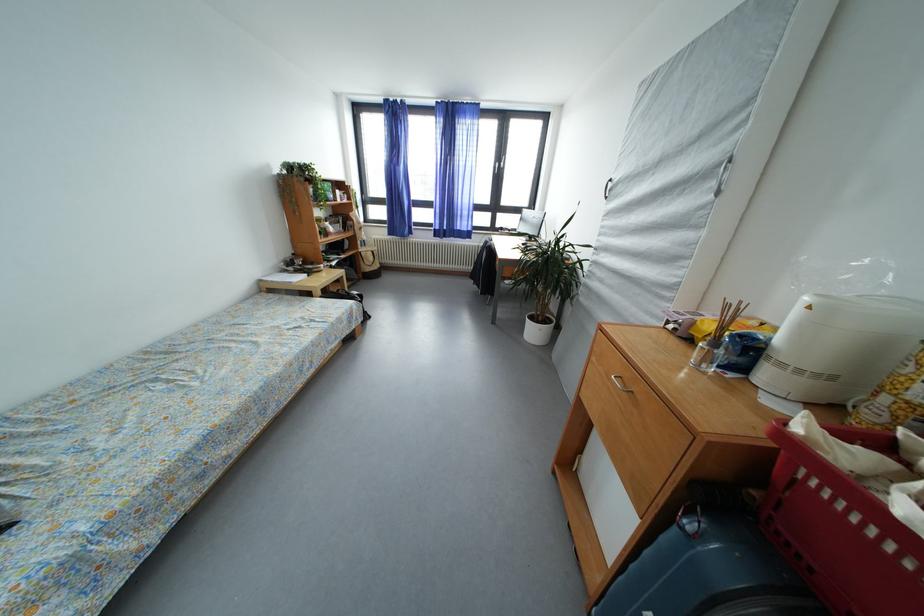
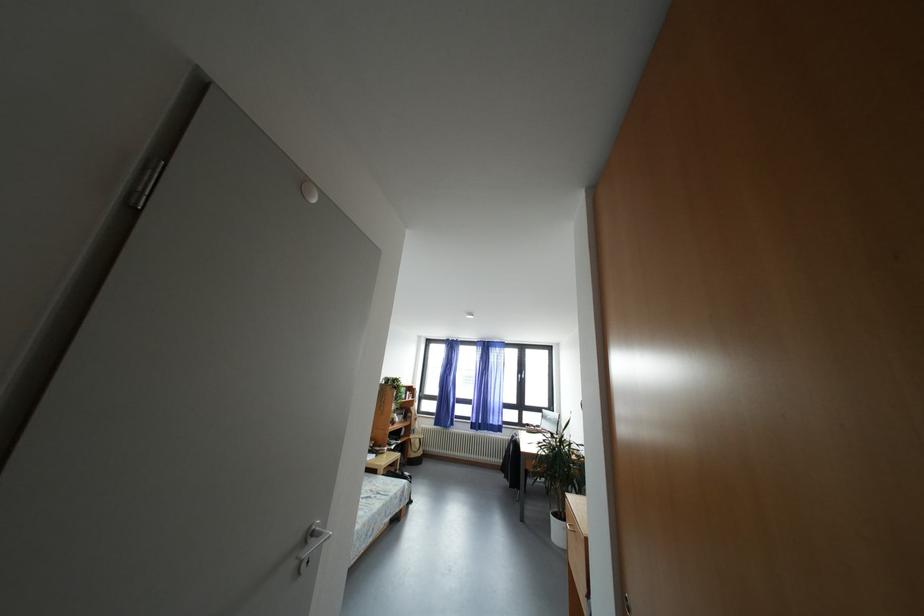
Where in the second image is the point corresponding to point (538, 323) from the first image?

(562, 519)